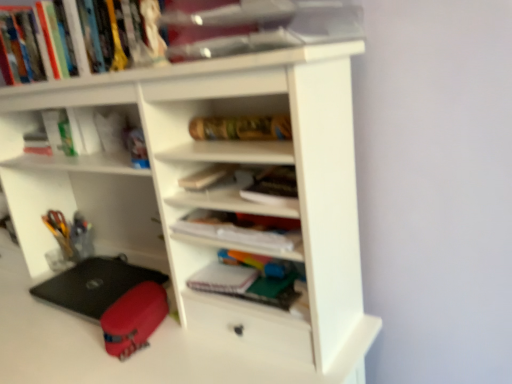
Question: Considering the relative sizes of black matte laptop at lower left and wooden textured book at center, placed as the 2th book when sorted from top to bottom, in the image provided, is black matte laptop at lower left wider than wooden textured book at center, placed as the 2th book when sorted from top to bottom,?

Choices:
 (A) no
 (B) yes

Answer: (B)

Question: Considering the relative positions of black matte laptop at lower left and wooden textured book at center, which is counted as the fifth book, starting from the bottom, in the image provided, is black matte laptop at lower left to the right of wooden textured book at center, which is counted as the fifth book, starting from the bottom, from the viewer's perspective?

Choices:
 (A) yes
 (B) no

Answer: (B)

Question: Are black matte laptop at lower left and wooden textured book at center, which is counted as the fifth book, starting from the bottom, making contact?

Choices:
 (A) no
 (B) yes

Answer: (A)

Question: Can wooden textured book at center, which is counted as the fifth book, starting from the bottom, be found inside black matte laptop at lower left?

Choices:
 (A) yes
 (B) no

Answer: (B)

Question: Is black matte laptop at lower left turned away from wooden textured book at center, placed as the 2th book when sorted from top to bottom?

Choices:
 (A) yes
 (B) no

Answer: (B)

Question: Looking at their shapes, would you say white matte notebook at center, placed as the sixth book when sorted from top to bottom, is wider or thinner than black matte laptop at lower left?

Choices:
 (A) thin
 (B) wide

Answer: (A)

Question: Considering their positions, is white matte notebook at center, the first book ordered from the bottom, located in front of or behind black matte laptop at lower left?

Choices:
 (A) front
 (B) behind

Answer: (A)

Question: Is point (219, 279) closer or farther from the camera than point (49, 286)?

Choices:
 (A) farther
 (B) closer

Answer: (B)

Question: Is white matte notebook at center, placed as the sixth book when sorted from top to bottom, bigger or smaller than black matte laptop at lower left?

Choices:
 (A) small
 (B) big

Answer: (A)

Question: From the image's perspective, relative to hardcover book at center, which is the fourth book from top to bottom, is white matte notebook at center, the first book ordered from the bottom, above or below?

Choices:
 (A) below
 (B) above

Answer: (A)

Question: Considering the positions of white matte notebook at center, placed as the sixth book when sorted from top to bottom, and hardcover book at center, which is the fourth book from top to bottom, in the image, is white matte notebook at center, placed as the sixth book when sorted from top to bottom, taller or shorter than hardcover book at center, which is the fourth book from top to bottom,?

Choices:
 (A) tall
 (B) short

Answer: (B)

Question: From a real-world perspective, is white matte notebook at center, placed as the sixth book when sorted from top to bottom, above or below hardcover book at center, which is the fourth book from top to bottom?

Choices:
 (A) below
 (B) above

Answer: (A)

Question: Considering the positions of white matte notebook at center, placed as the sixth book when sorted from top to bottom, and hardcover book at center, the third book in the bottom-to-top sequence, in the image, is white matte notebook at center, placed as the sixth book when sorted from top to bottom, wider or thinner than hardcover book at center, the third book in the bottom-to-top sequence,?

Choices:
 (A) wide
 (B) thin

Answer: (B)

Question: From the image's perspective, relative to black matte laptop at lower left, is hardcover book at center, the third book in the bottom-to-top sequence, above or below?

Choices:
 (A) above
 (B) below

Answer: (A)

Question: Which is correct: hardcover book at center, which is the fourth book from top to bottom, is inside black matte laptop at lower left, or outside of it?

Choices:
 (A) inside
 (B) outside

Answer: (B)